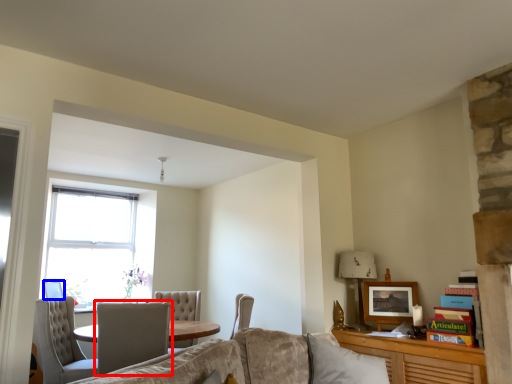
Question: Which object appears closest to the camera in this image, chair (highlighted by a red box) or picture frame (highlighted by a blue box)?

Choices:
 (A) chair
 (B) picture frame

Answer: (A)